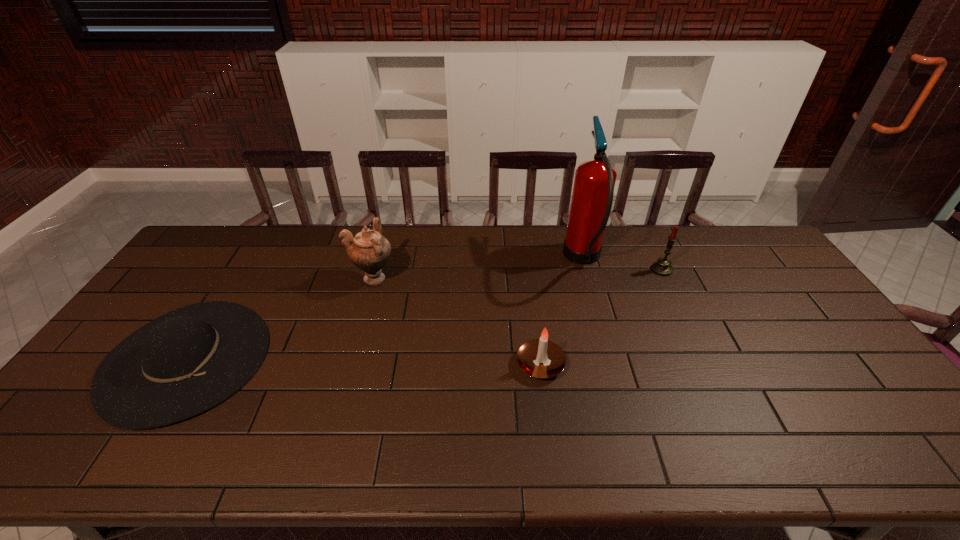
At what (x,y) coordinates should I click in order to perform the action: click on fire extinguisher. Please return your answer as a coordinate pair (x, y). This screenshot has width=960, height=540. Looking at the image, I should click on (593, 190).

In order to click on the fourth object from left to right in this screenshot , I will do `click(593, 190)`.

I want to click on the fourth object from right to left, so click(x=369, y=251).

Where is `the second tallest object`? the second tallest object is located at coordinates 369,251.

Where is `the right candle`? The width and height of the screenshot is (960, 540). the right candle is located at coordinates (662, 267).

What are the coordinates of `the farther candle` in the screenshot? It's located at (662, 267).

Locate an element on the screen. The image size is (960, 540). the third object from left to right is located at coordinates (530, 355).

Find the location of a particular element. The height and width of the screenshot is (540, 960). the nearer candle is located at coordinates (530, 355).

Where is `sombrero`? sombrero is located at coordinates (183, 363).

Identify the location of vacant area located 0.050m on the back of the tallest object. (574, 226).